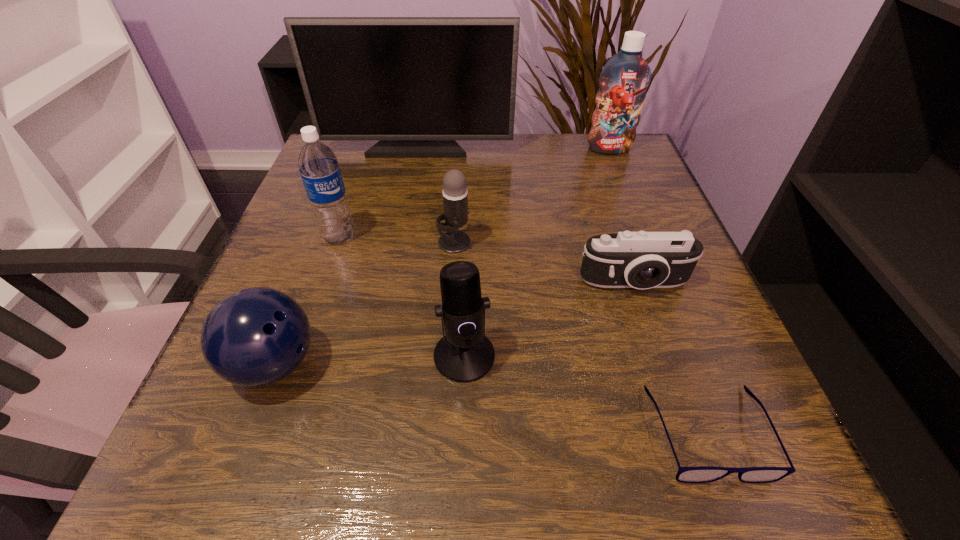
The width and height of the screenshot is (960, 540). I want to click on water bottle at the left edge, so click(x=318, y=165).

This screenshot has height=540, width=960. I want to click on bowling ball located in the left edge section of the desktop, so click(254, 337).

Locate an element on the screen. This screenshot has height=540, width=960. shampoo that is at the right edge is located at coordinates pyautogui.click(x=625, y=77).

The height and width of the screenshot is (540, 960). I want to click on camera present at the right edge, so click(x=642, y=260).

The height and width of the screenshot is (540, 960). Find the location of `spectacles located in the right edge section of the desktop`. spectacles located in the right edge section of the desktop is located at coordinates (702, 474).

This screenshot has height=540, width=960. I want to click on object that is at the far left corner, so click(x=417, y=84).

You are a GUI agent. You are given a task and a screenshot of the screen. Output one action in this format:
    pyautogui.click(x=<x>, y=<y>)
    Task: Click on the object that is at the far right corner
    The image size is (960, 540).
    Given the screenshot: What is the action you would take?
    pyautogui.click(x=625, y=77)

What are the coordinates of `object at the near right corner` in the screenshot? It's located at point(702,474).

In the image, there is a desktop. At what (x,y) coordinates should I click in order to perform the action: click on free space at the far edge. Please return your answer as a coordinate pair (x, y). The height and width of the screenshot is (540, 960). Looking at the image, I should click on (498, 168).

Where is `vacant space at the near edge of the desktop`? The width and height of the screenshot is (960, 540). vacant space at the near edge of the desktop is located at coordinates (345, 475).